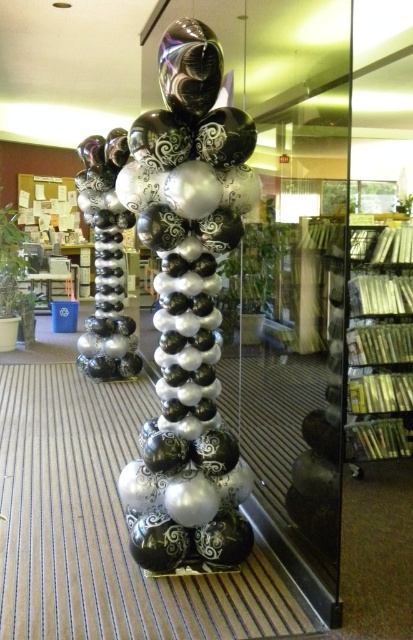
Is point (158, 326) positioned before point (406, 364)?

Yes, it is in front of point (406, 364).

At what (x,y) coordinates should I click in order to perform the action: click on black glossy balloons at center. Please return your answer as a coordinate pair (x, y). Looking at the image, I should click on (175, 300).